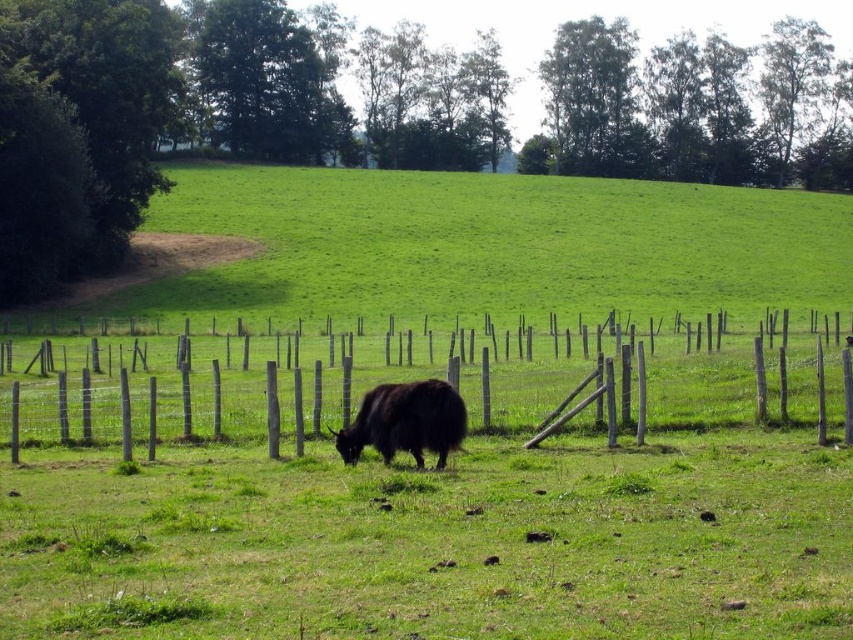
Question: Is wooden post fence at center bigger than black fuzzy yak at center?

Choices:
 (A) no
 (B) yes

Answer: (B)

Question: Considering the relative positions of wooden post fence at center and black fuzzy yak at center in the image provided, where is wooden post fence at center located with respect to black fuzzy yak at center?

Choices:
 (A) left
 (B) right

Answer: (A)

Question: Does wooden post fence at center have a lesser width compared to black fuzzy yak at center?

Choices:
 (A) yes
 (B) no

Answer: (B)

Question: Which point is farther from the camera taking this photo?

Choices:
 (A) (445, 388)
 (B) (664, 376)

Answer: (B)